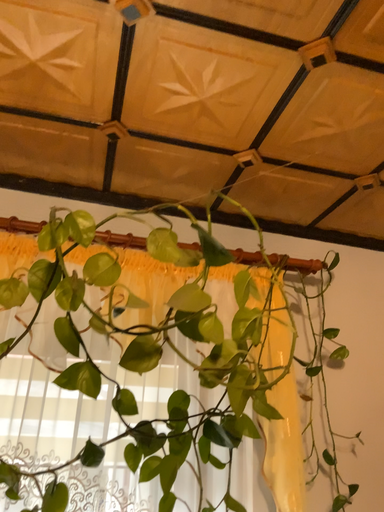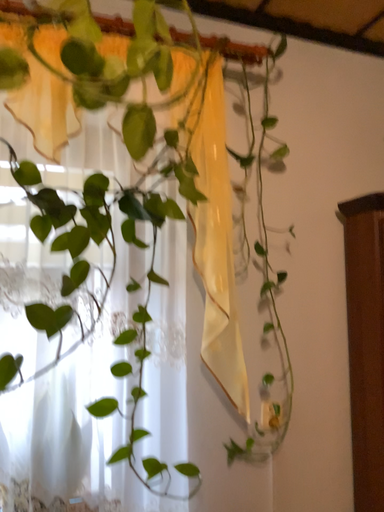
Question: How did the camera likely rotate when shooting the video?

Choices:
 (A) rotated downward
 (B) rotated upward

Answer: (A)